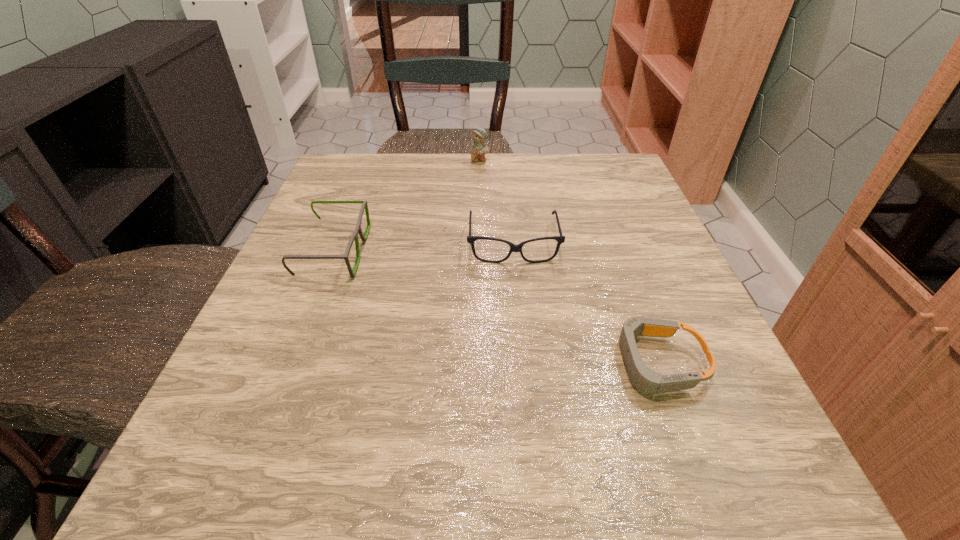
Where is `vacant position at the far right corner of the desktop`? The width and height of the screenshot is (960, 540). vacant position at the far right corner of the desktop is located at coordinates (565, 164).

Where is `vacant region at the near right corner of the desktop`? This screenshot has height=540, width=960. vacant region at the near right corner of the desktop is located at coordinates (719, 453).

Locate an element on the screen. The height and width of the screenshot is (540, 960). free space between the left spectacles and the nearest object is located at coordinates (495, 307).

The width and height of the screenshot is (960, 540). I want to click on free space between the right spectacles and the leftmost object, so click(x=423, y=248).

Image resolution: width=960 pixels, height=540 pixels. I want to click on free space that is in between the right spectacles and the goggles, so click(x=585, y=303).

The width and height of the screenshot is (960, 540). I want to click on unoccupied area between the nearest object and the leftmost object, so click(x=495, y=307).

The image size is (960, 540). I want to click on vacant space in between the left spectacles and the goggles, so click(495, 307).

At what (x,y) coordinates should I click in order to perform the action: click on unoccupied position between the left spectacles and the goggles. Please return your answer as a coordinate pair (x, y). The image size is (960, 540). Looking at the image, I should click on (495, 307).

This screenshot has height=540, width=960. Identify the location of vacant area that lies between the shortest object and the tallest object. (568, 262).

The height and width of the screenshot is (540, 960). Identify the location of free space between the tallest object and the right spectacles. (496, 203).